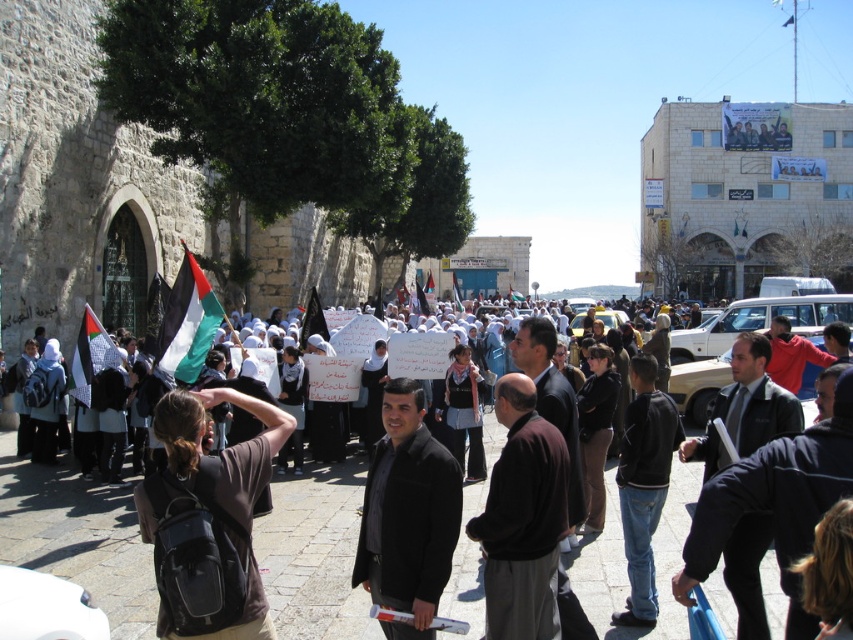
Question: Which point is closer to the camera?

Choices:
 (A) (691, 572)
 (B) (490, 580)
 (C) (94, 353)
 (D) (187, 292)

Answer: (A)

Question: Among these objects, which one is nearest to the camera?

Choices:
 (A) dark suit at center
 (B) black and white flag at center

Answer: (A)

Question: Is dark suit at center smaller than black and white flag at center?

Choices:
 (A) yes
 (B) no

Answer: (A)

Question: Which is farther from the red cotton shirt at center?

Choices:
 (A) black matte jacket at center
 (B) black and white flag at left
 (C) brown matte jacket at center

Answer: (B)

Question: Considering the relative positions of brown matte jacket at center and black and white flag at center in the image provided, where is brown matte jacket at center located with respect to black and white flag at center?

Choices:
 (A) above
 (B) below

Answer: (B)

Question: Does black matte jacket at center have a greater width compared to brown matte jacket at center?

Choices:
 (A) yes
 (B) no

Answer: (A)